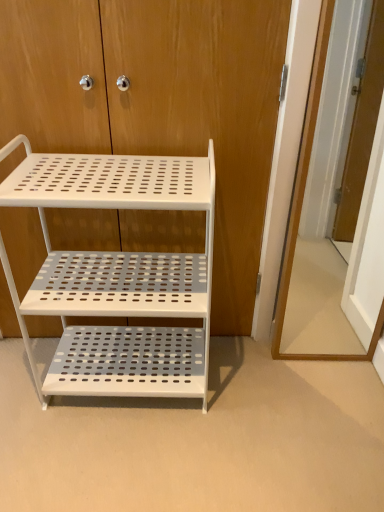
Question: Can you confirm if wooden door at right is bigger than white perforated metal shelf at center?

Choices:
 (A) no
 (B) yes

Answer: (A)

Question: Is wooden door at right placed right next to white perforated metal shelf at center?

Choices:
 (A) yes
 (B) no

Answer: (B)

Question: Does wooden door at right have a smaller size compared to white perforated metal shelf at center?

Choices:
 (A) no
 (B) yes

Answer: (B)

Question: Is white perforated metal shelf at center completely or partially inside wooden door at right?

Choices:
 (A) no
 (B) yes

Answer: (A)

Question: From the image's perspective, would you say wooden door at right is shown under white perforated metal shelf at center?

Choices:
 (A) yes
 (B) no

Answer: (B)

Question: From the image's perspective, is wooden door at right positioned above or below white perforated metal shelf at center?

Choices:
 (A) below
 (B) above

Answer: (B)

Question: Considering the positions of wooden door at right and white perforated metal shelf at center in the image, is wooden door at right wider or thinner than white perforated metal shelf at center?

Choices:
 (A) thin
 (B) wide

Answer: (A)

Question: Is point (283, 287) closer or farther from the camera than point (109, 372)?

Choices:
 (A) closer
 (B) farther

Answer: (B)

Question: Is wooden door at right bigger or smaller than white perforated metal shelf at center?

Choices:
 (A) small
 (B) big

Answer: (A)

Question: From a real-world perspective, is white perforated metal shelf at center above or below white perforated metal shelf at center?

Choices:
 (A) below
 (B) above

Answer: (B)

Question: Based on their positions, is white perforated metal shelf at center located to the left or right of white perforated metal shelf at center?

Choices:
 (A) left
 (B) right

Answer: (B)

Question: In the image, is white perforated metal shelf at center positioned in front of or behind white perforated metal shelf at center?

Choices:
 (A) front
 (B) behind

Answer: (B)

Question: Considering the positions of point (203, 129) and point (41, 282), is point (203, 129) closer or farther from the camera than point (41, 282)?

Choices:
 (A) closer
 (B) farther

Answer: (A)

Question: In the image, is white perforated metal shelf at center on the left side or the right side of wooden door at right?

Choices:
 (A) right
 (B) left

Answer: (B)

Question: Is white perforated metal shelf at center taller or shorter than wooden door at right?

Choices:
 (A) tall
 (B) short

Answer: (B)